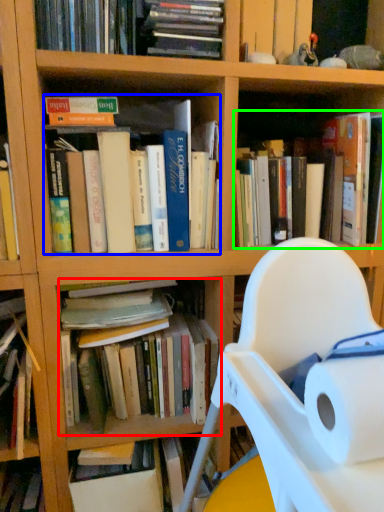
Question: Which object is the farthest from book (highlighted by a red box)? Choose among these: book (highlighted by a blue box) or book (highlighted by a green box).

Choices:
 (A) book
 (B) book

Answer: (B)